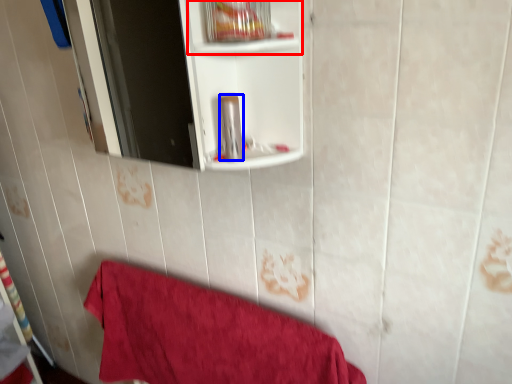
Question: Which of the following is the closest to the observer, cabinet (highlighted by a red box) or toiletry (highlighted by a blue box)?

Choices:
 (A) cabinet
 (B) toiletry

Answer: (A)